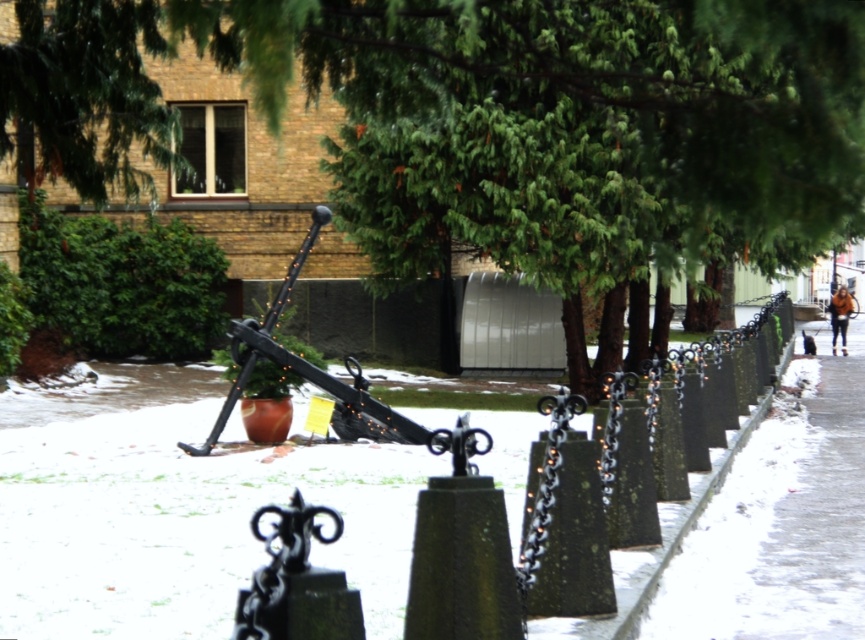
Does green textured tree at center appear over slick concrete sidewalk at lower right?

Yes.

Is green textured tree at center positioned behind slick concrete sidewalk at lower right?

No, green textured tree at center is closer to the viewer.

Which is in front, point (482, 16) or point (729, 508)?

Point (729, 508) is in front.

Identify the location of green textured tree at center. (492, 120).

Who is positioned more to the left, slick concrete sidewalk at lower right or brown leather jacket at right?

Positioned to the left is slick concrete sidewalk at lower right.

Which is more to the right, slick concrete sidewalk at lower right or brown leather jacket at right?

From the viewer's perspective, brown leather jacket at right appears more on the right side.

The image size is (865, 640). In order to click on slick concrete sidewalk at lower right in this screenshot , I will do `click(782, 516)`.

Does green textured tree at center appear on the right side of brown leather jacket at right?

No, green textured tree at center is not to the right of brown leather jacket at right.

Does green textured tree at center have a smaller size compared to brown leather jacket at right?

Actually, green textured tree at center might be larger than brown leather jacket at right.

The height and width of the screenshot is (640, 865). In order to click on green textured tree at center in this screenshot , I will do `click(492, 120)`.